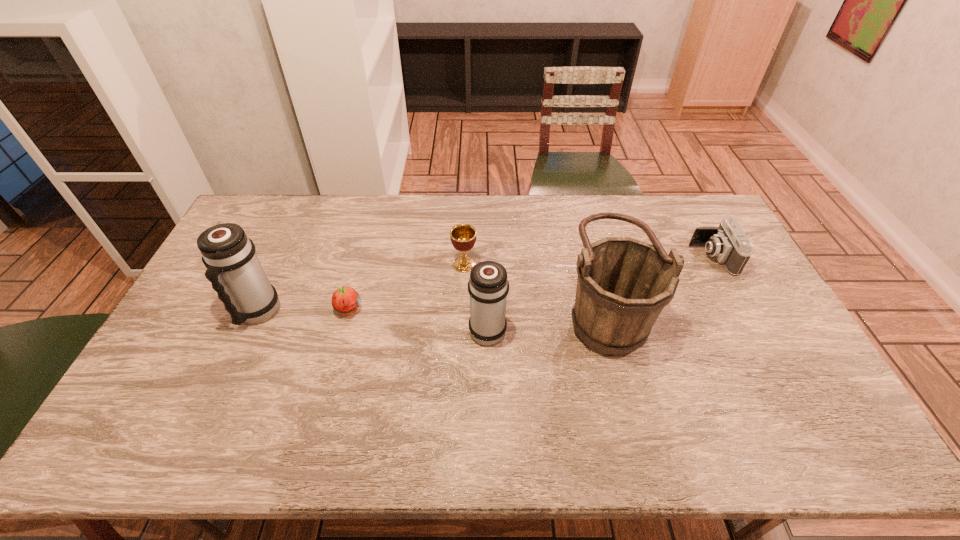
Considering the uniform spacing of thermos bottles, where should an additional thermos bottle be positioned on the right? Please locate a free spot. Please provide its 2D coordinates. Your answer should be formatted as a tuple, i.e. [(x, y)], where the tuple contains the x and y coordinates of a point satisfying the conditions above.

[(733, 348)]